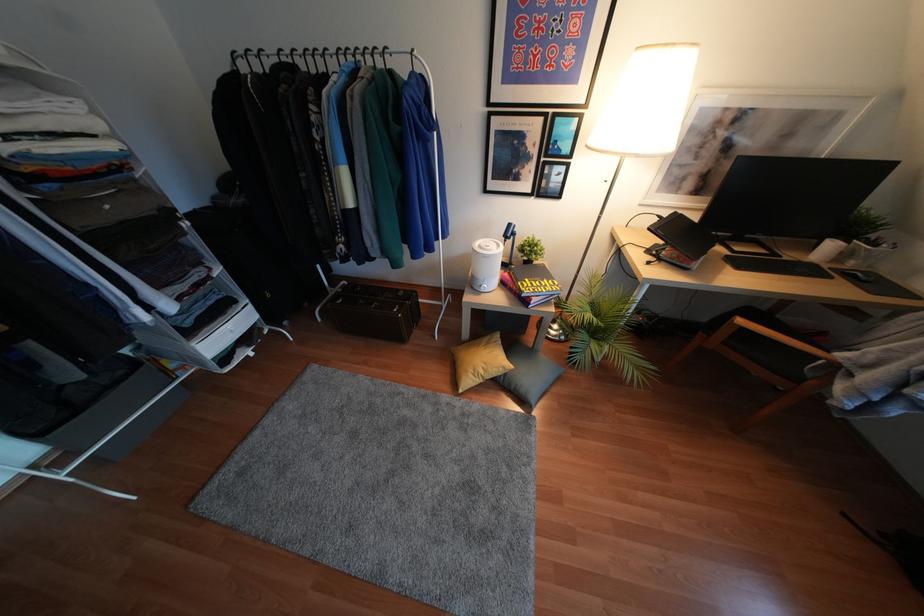
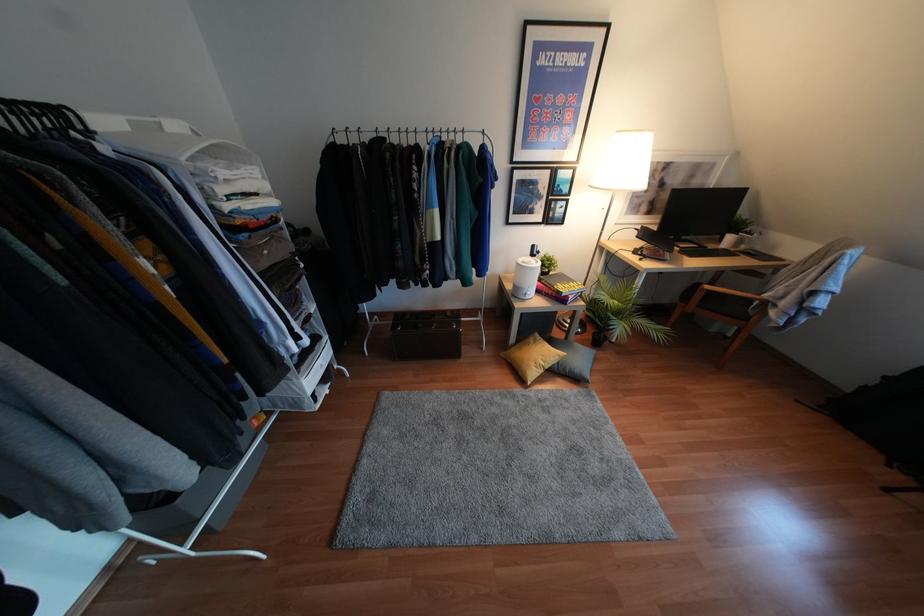
Find the pixel in the second image that matches (796,379) in the first image.

(745, 318)